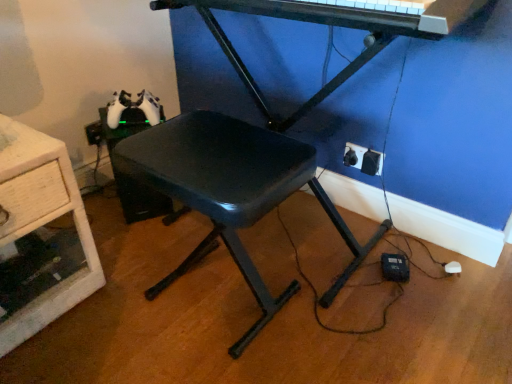
Question: Should I look upward or downward to see black plastic electric outlet at lower right, which ranks as the 2th electric outlet in front-to-back order?

Choices:
 (A) up
 (B) down

Answer: (A)

Question: Considering the relative sizes of black plastic stool at center and wooden drawer at left in the image provided, is black plastic stool at center shorter than wooden drawer at left?

Choices:
 (A) no
 (B) yes

Answer: (A)

Question: From the image's perspective, is black plastic stool at center beneath wooden drawer at left?

Choices:
 (A) yes
 (B) no

Answer: (A)

Question: Are black plastic stool at center and wooden drawer at left located far from each other?

Choices:
 (A) yes
 (B) no

Answer: (B)

Question: Is black plastic stool at center next to wooden drawer at left?

Choices:
 (A) no
 (B) yes

Answer: (A)

Question: Would you say black plastic stool at center contains wooden drawer at left?

Choices:
 (A) no
 (B) yes

Answer: (A)

Question: Is the position of black plastic stool at center less distant than that of wooden drawer at left?

Choices:
 (A) no
 (B) yes

Answer: (B)

Question: Considering the relative positions of wooden drawer at left and black plastic electric outlet at lower right, which is the 1th electric outlet from back to front, in the image provided, is wooden drawer at left to the left of black plastic electric outlet at lower right, which is the 1th electric outlet from back to front, from the viewer's perspective?

Choices:
 (A) yes
 (B) no

Answer: (A)

Question: Is wooden drawer at left positioned before black plastic electric outlet at lower right, which ranks as the 2th electric outlet in front-to-back order?

Choices:
 (A) yes
 (B) no

Answer: (A)

Question: Is wooden drawer at left outside black plastic electric outlet at lower right, which is the 1th electric outlet from back to front?

Choices:
 (A) no
 (B) yes

Answer: (B)

Question: Is wooden drawer at left at the right side of black plastic electric outlet at lower right, which is the 1th electric outlet from back to front?

Choices:
 (A) yes
 (B) no

Answer: (B)

Question: Are wooden drawer at left and black plastic electric outlet at lower right, which is the 1th electric outlet from back to front, located far from each other?

Choices:
 (A) yes
 (B) no

Answer: (A)

Question: Is the position of wooden drawer at left more distant than that of black plastic electric outlet at lower right, which is the 1th electric outlet from back to front?

Choices:
 (A) yes
 (B) no

Answer: (B)

Question: Does metallic black piano at upper center lie in front of wooden drawer at left?

Choices:
 (A) no
 (B) yes

Answer: (B)